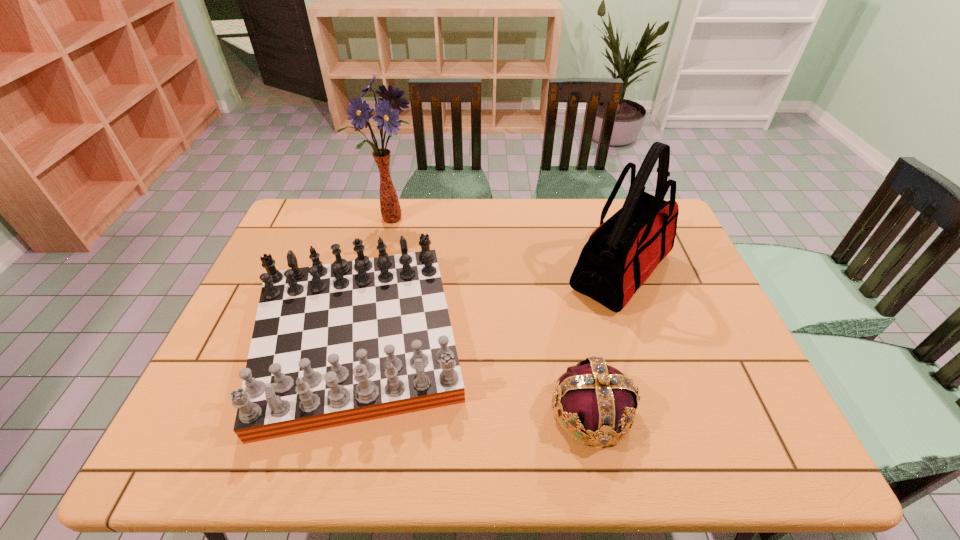
I want to click on free area in between the crown and the duffel bag, so click(x=606, y=342).

Find the location of a particular element. The height and width of the screenshot is (540, 960). free spot between the duffel bag and the crown is located at coordinates (x=606, y=342).

Where is `free spot between the crown and the gameboard`? This screenshot has width=960, height=540. free spot between the crown and the gameboard is located at coordinates (474, 375).

This screenshot has height=540, width=960. What are the coordinates of `empty space that is in between the duffel bag and the crown` in the screenshot? It's located at (606, 342).

Locate an element on the screen. blank region between the crown and the duffel bag is located at coordinates (606, 342).

Find the location of `unoccupied area between the duffel bag and the gameboard`. unoccupied area between the duffel bag and the gameboard is located at coordinates coord(490,305).

The width and height of the screenshot is (960, 540). Identify the location of free space between the crown and the flower arrangement. (491, 315).

Where is `vacant region between the duffel bag and the crown`? This screenshot has width=960, height=540. vacant region between the duffel bag and the crown is located at coordinates (606, 342).

The image size is (960, 540). Identify the location of free space that is in between the duffel bag and the crown. (606, 342).

The width and height of the screenshot is (960, 540). What are the coordinates of `vacant space in between the crown and the duffel bag` in the screenshot? It's located at (606, 342).